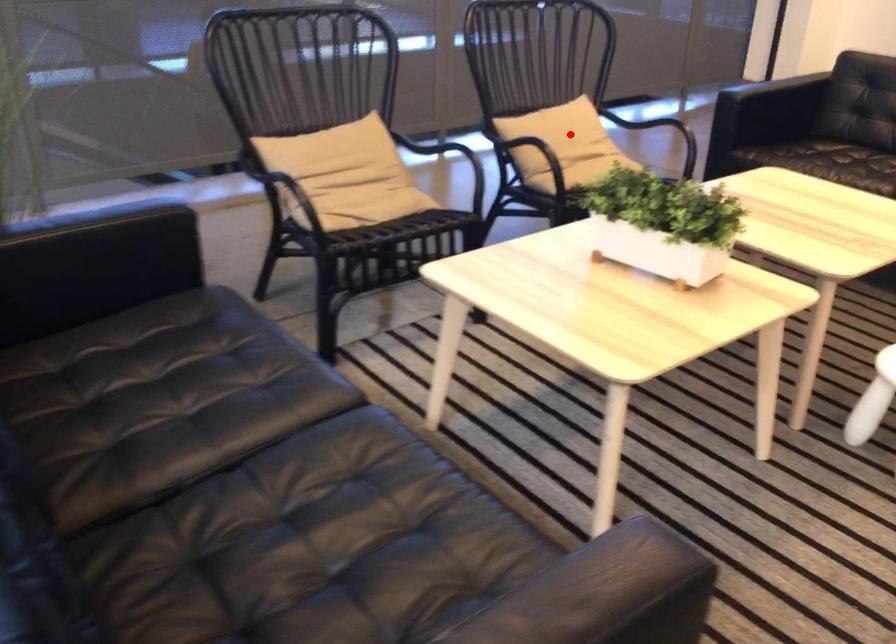
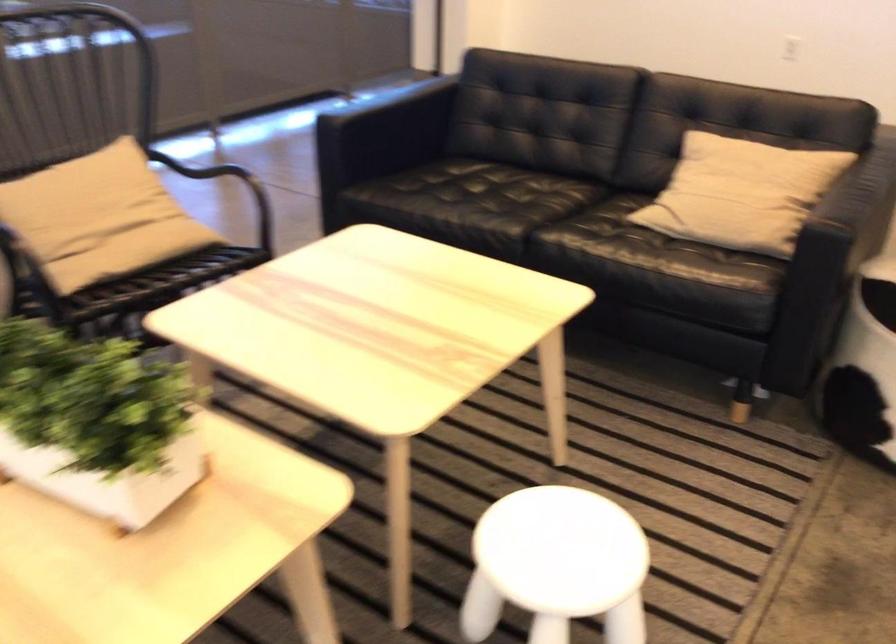
The point at the highlighted location is marked in the first image. Where is the corresponding point in the second image?

(99, 214)